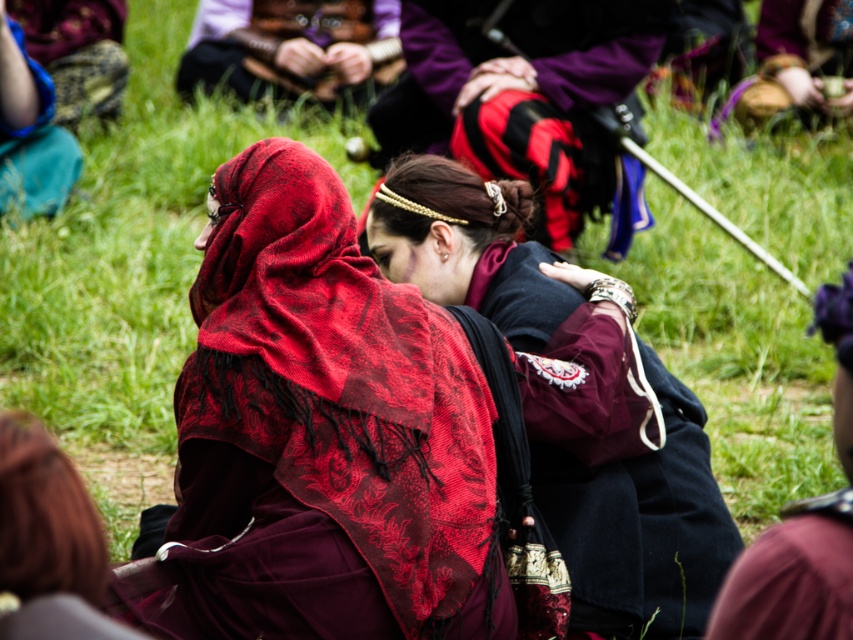
Does velvet maroon dress at center appear under velvet burgundy dress at center?

Correct, velvet maroon dress at center is located below velvet burgundy dress at center.

Which is behind, point (238, 522) or point (520, 268)?

Point (520, 268)

Does point (283, 241) come behind point (643, 461)?

No, (283, 241) is in front of (643, 461).

At what (x,y) coordinates should I click in order to perform the action: click on velvet maroon dress at center. Please return your answer as a coordinate pair (x, y). This screenshot has width=853, height=640. Looking at the image, I should click on (322, 433).